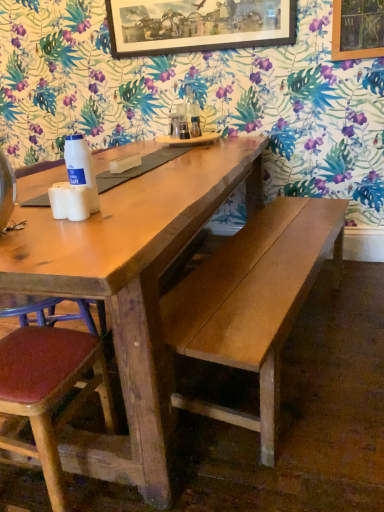
Find the location of `vacant area on top of wooden bench at center (from a real-world perspective)`. vacant area on top of wooden bench at center (from a real-world perspective) is located at coordinates (269, 245).